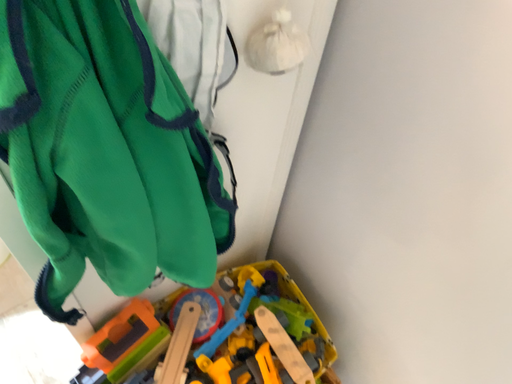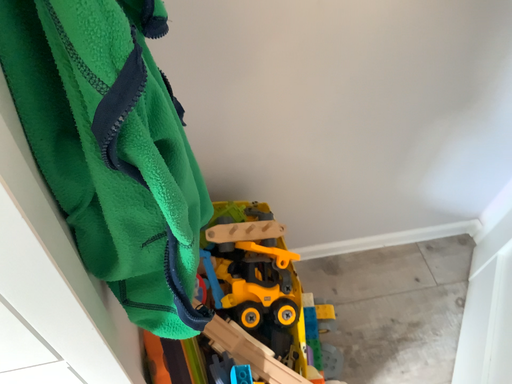
Question: How did the camera likely rotate when shooting the video?

Choices:
 (A) rotated right
 (B) rotated left

Answer: (A)